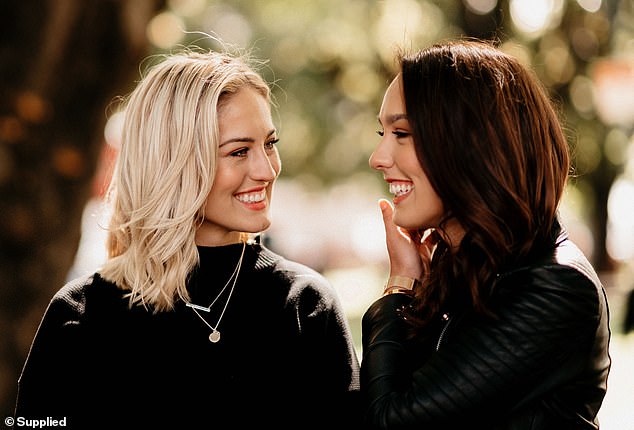
Find the location of a particular element. The height and width of the screenshot is (430, 634). pendant is located at coordinates (212, 333).